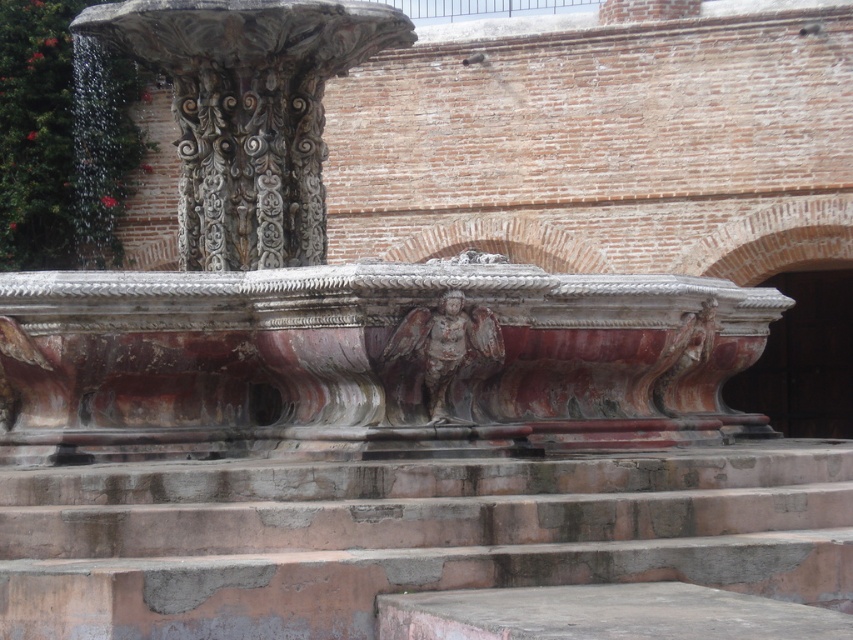
Based on the scene description, where is the marble fountain at center located in terms of coordinates?

The marble fountain at center is located at point (331, 292).

You are an architect inspecting the ancient structure. You need to determine which object is taller between the rustic stone stairs at center and the carved stone column at upper left. Based on the scene, which one is taller?

The carved stone column at upper left is taller than the rustic stone stairs at center.